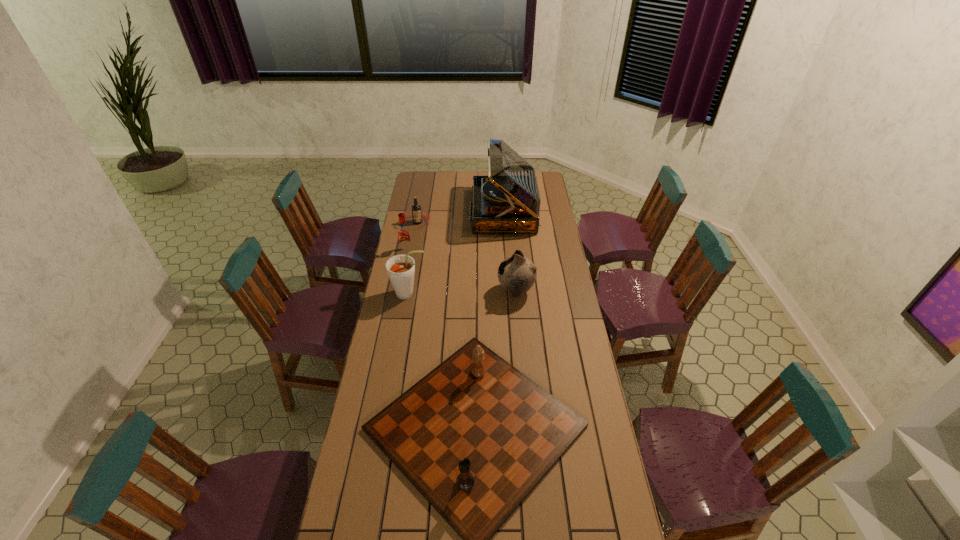
Find the location of `blank area located 0.290m from the spout of the pottery`. blank area located 0.290m from the spout of the pottery is located at coordinates (435, 291).

The height and width of the screenshot is (540, 960). I want to click on vacant region located 0.170m on the drink side of the nearest root beer, so click(465, 294).

I want to click on vacant space positioned on the back of the second farthest root beer, so click(x=410, y=234).

Locate an element on the screen. free space located 0.090m on the label of the shortest root beer is located at coordinates (415, 240).

This screenshot has height=540, width=960. I want to click on object situated at the far edge, so click(x=506, y=201).

Identify the location of object situated at the right edge. The width and height of the screenshot is (960, 540). (506, 201).

The height and width of the screenshot is (540, 960). I want to click on object that is at the far right corner, so click(x=506, y=201).

In the image, there is a desktop. At what (x,y) coordinates should I click in order to perform the action: click on free space at the far edge. Please return your answer as a coordinate pair (x, y). The height and width of the screenshot is (540, 960). Looking at the image, I should click on (442, 174).

In the image, there is a desktop. Identify the location of vacant space at the left edge. (371, 498).

Locate an element on the screen. This screenshot has width=960, height=540. free space at the right edge of the desktop is located at coordinates (553, 288).